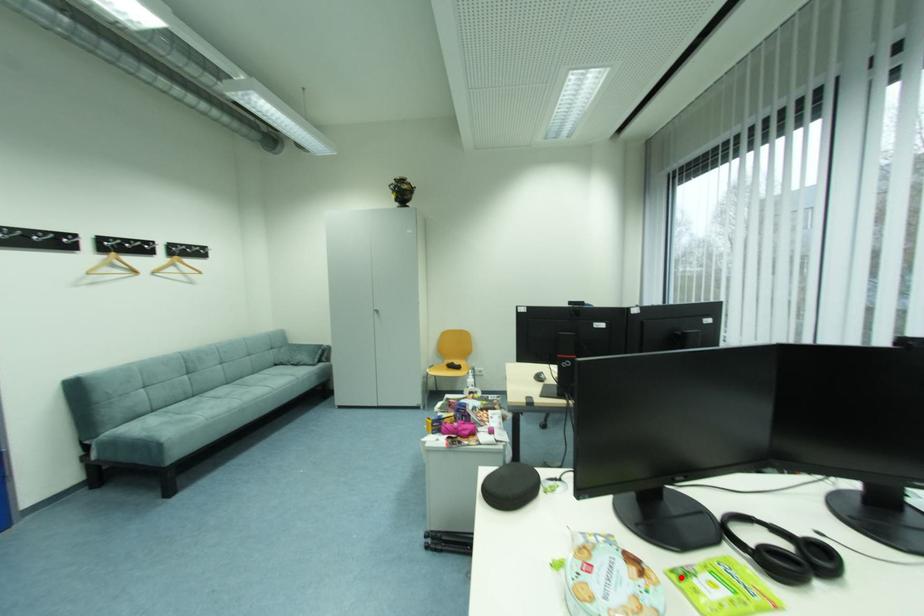
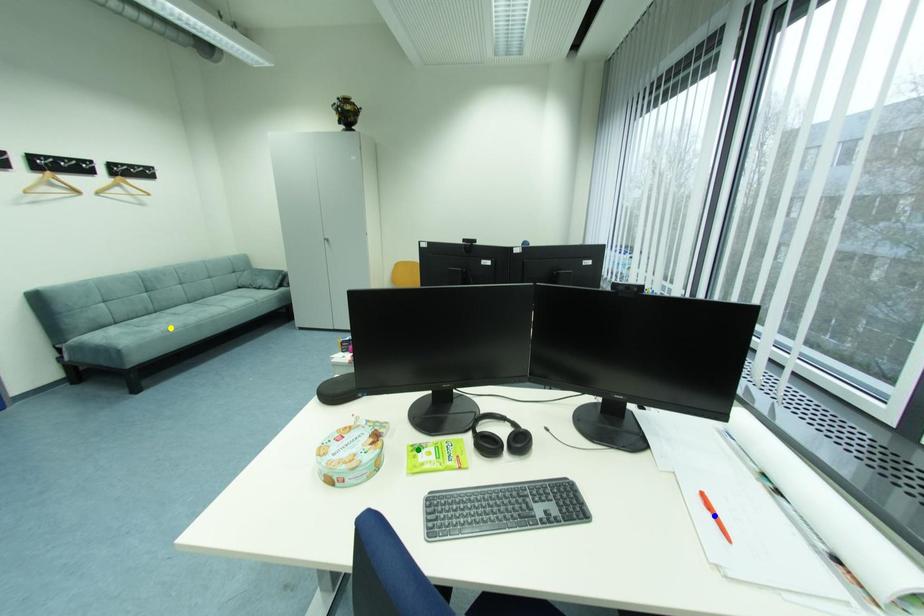
Question: I am providing you with two images of the same scene from different viewpoints. A red point is marked on the first image. You are given multiple points on the second image. Can you choose the point in image 2 that corresponds to the point in image 1?

Choices:
 (A) yellow point
 (B) blue point
 (C) green point

Answer: (C)